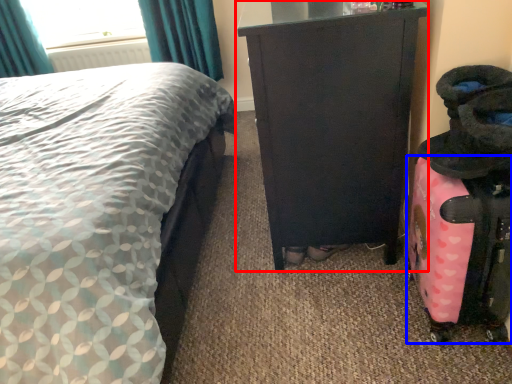
Question: Which object appears farthest to the camera in this image, furniture (highlighted by a red box) or luggage (highlighted by a blue box)?

Choices:
 (A) furniture
 (B) luggage

Answer: (A)